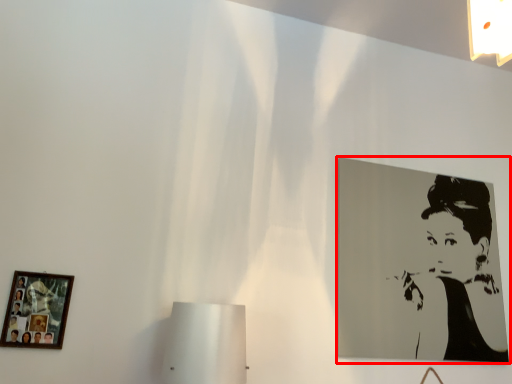
Question: From the image's perspective, what is the correct spatial positioning of picture frame (annotated by the red box) in reference to picture frame?

Choices:
 (A) above
 (B) below

Answer: (A)